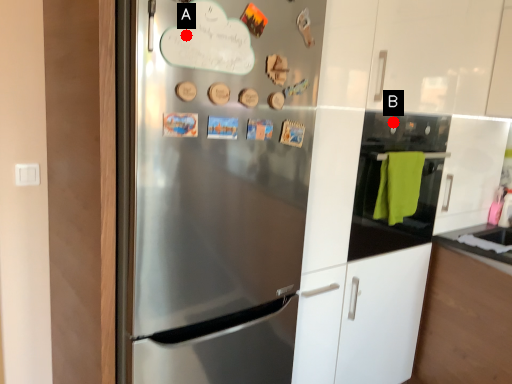
Question: Two points are circled on the image, labeled by A and B beside each circle. Which point is closer to the camera?

Choices:
 (A) A is closer
 (B) B is closer

Answer: (A)